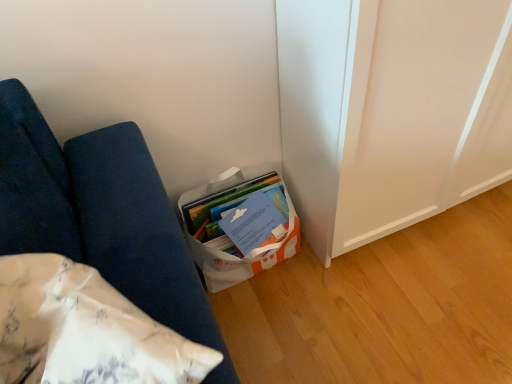
Question: Is white fabric cushion at lower left to the left or to the right of white paper bag at lower center in the image?

Choices:
 (A) left
 (B) right

Answer: (A)

Question: From the image's perspective, is white fabric cushion at lower left positioned above or below white paper bag at lower center?

Choices:
 (A) above
 (B) below

Answer: (B)

Question: Considering the positions of point (223, 369) and point (278, 196), is point (223, 369) closer or farther from the camera than point (278, 196)?

Choices:
 (A) closer
 (B) farther

Answer: (A)

Question: From the image's perspective, is white paper bag at lower center positioned above or below white fabric cushion at lower left?

Choices:
 (A) above
 (B) below

Answer: (A)

Question: Looking at their shapes, would you say white paper bag at lower center is wider or thinner than white fabric cushion at lower left?

Choices:
 (A) thin
 (B) wide

Answer: (B)

Question: Is white paper bag at lower center situated inside white fabric cushion at lower left or outside?

Choices:
 (A) outside
 (B) inside

Answer: (A)

Question: Looking at the image, does white paper bag at lower center seem bigger or smaller compared to white fabric cushion at lower left?

Choices:
 (A) big
 (B) small

Answer: (B)